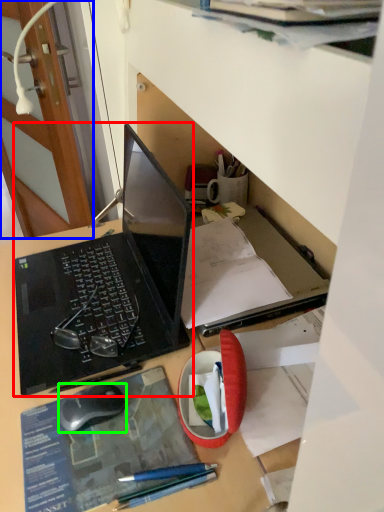
Question: Considering the real-world distances, which object is closest to laptop (highlighted by a red box)? door (highlighted by a blue box) or computer mouse (highlighted by a green box).

Choices:
 (A) door
 (B) computer mouse

Answer: (B)